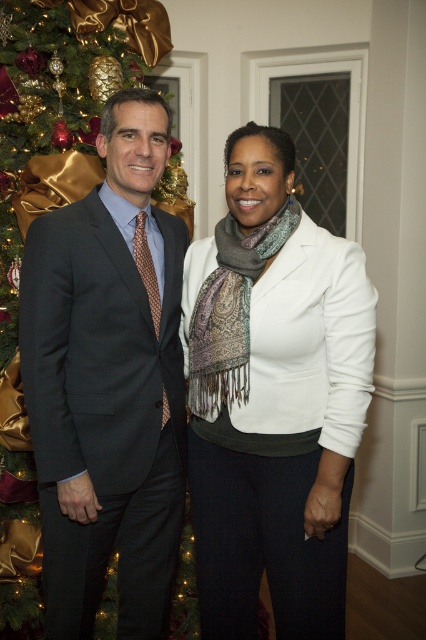
You are a photographer setting up a camera to capture two men at a formal event. The scene includes a matte black suit at center and a dark gray suit at left. Which man should you adjust your camera focus to ensure both are in frame without zooming in or out?

The matte black suit at center is wider than the dark gray suit at left, so you should focus on the center to ensure both are in frame without zooming.

You are a photographer taking a picture of the scene. The matte black suit at center is located at point (108, 381). Where should you focus your camera to capture the matte black suit at center clearly?

You should focus your camera at point (108, 381) to capture the matte black suit at center clearly.

You are a photographer positioned in front of the two men at a formal event. You need to capture a clear photo of both individuals. Since the matte black suit at center and the dark gray suit at left are at different distances, which one will appear closer to you in the photo?

The matte black suit at center will appear closer to you in the photo because it is positioned closer to the photographer than the dark gray suit at left, which is farther away.